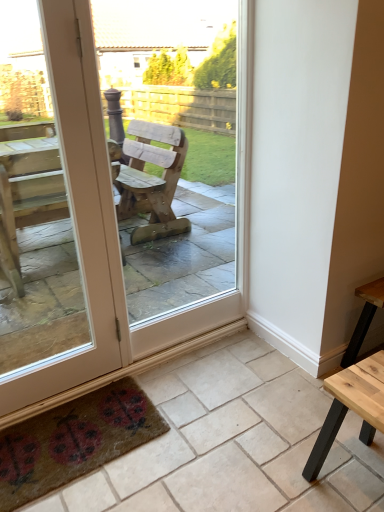
Identify the location of free spot above brown textured mat at lower left (from a real-world perspective). The width and height of the screenshot is (384, 512). (226, 430).